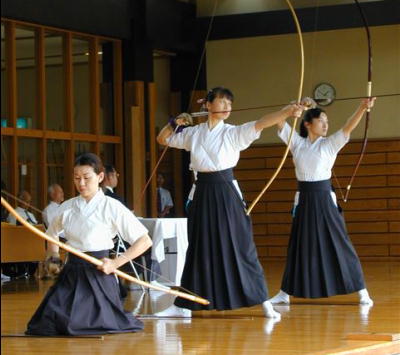
Locate an element on the screen. Image resolution: width=400 pixels, height=355 pixels. walls is located at coordinates (390, 68), (245, 74), (52, 88).